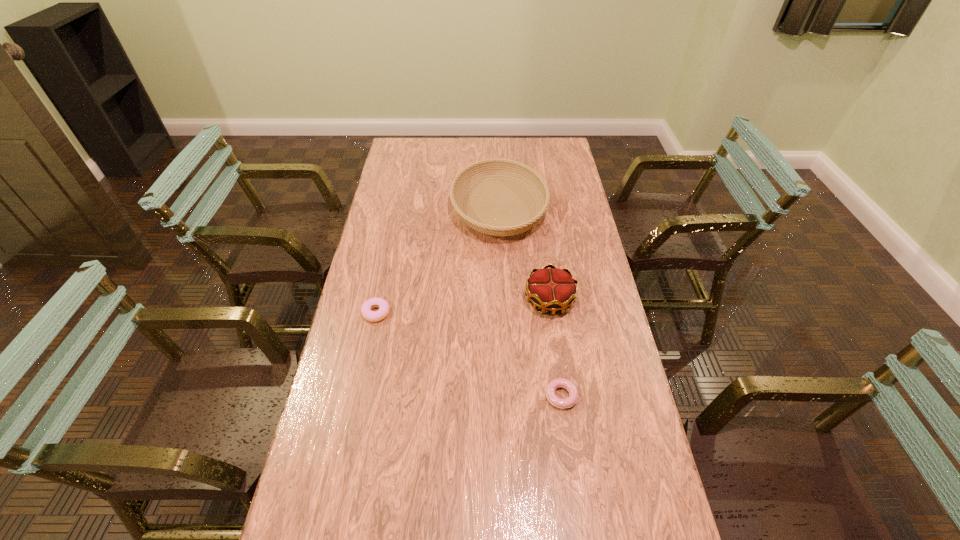
The image size is (960, 540). What are the coordinates of `free spot between the leftmost object and the basket` in the screenshot? It's located at 438,261.

I want to click on free space between the farther doughnut and the farthest object, so click(438, 261).

Find the location of `vacant space that's between the basket and the crown`. vacant space that's between the basket and the crown is located at coordinates (524, 255).

Locate an element on the screen. free space that is in between the crown and the basket is located at coordinates (524, 255).

Where is `object identified as the third closest to the shorter doughnut`? object identified as the third closest to the shorter doughnut is located at coordinates (498, 168).

At what (x,y) coordinates should I click in order to perform the action: click on object that stands as the closest to the farthest object. Please return your answer as a coordinate pair (x, y). The image size is (960, 540). Looking at the image, I should click on (552, 289).

Locate an element on the screen. Image resolution: width=960 pixels, height=540 pixels. vacant point that satisfies the following two spatial constraints: 1. on the back side of the crown; 2. on the left side of the third tallest object is located at coordinates (378, 300).

Locate an element on the screen. The image size is (960, 540). free location that satisfies the following two spatial constraints: 1. on the front side of the farthest object; 2. on the left side of the crown is located at coordinates (504, 300).

This screenshot has height=540, width=960. I want to click on vacant region that satisfies the following two spatial constraints: 1. on the back side of the crown; 2. on the left side of the nearest object, so click(x=548, y=300).